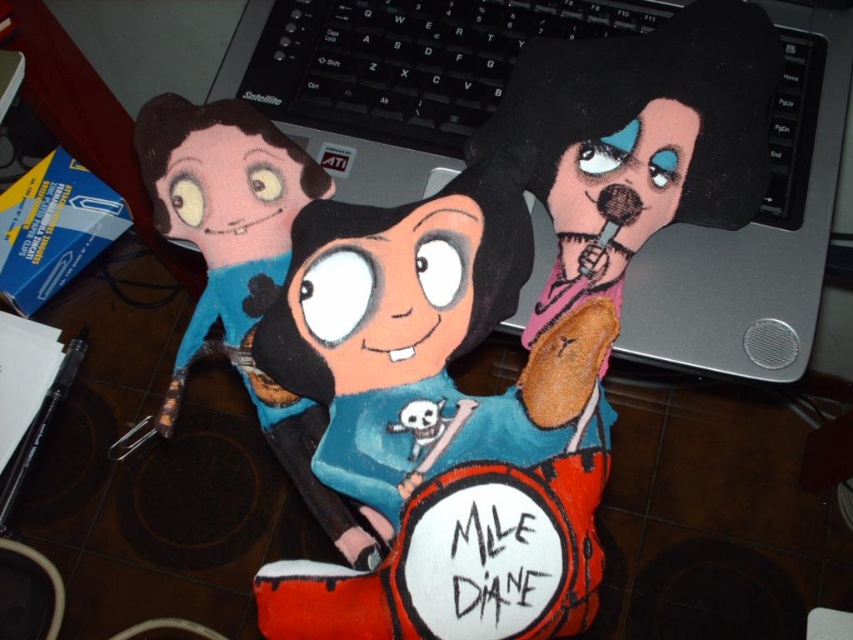
What do you see at coordinates (593, 141) in the screenshot? I see `silver metallic laptop at center` at bounding box center [593, 141].

Image resolution: width=853 pixels, height=640 pixels. Describe the element at coordinates (593, 141) in the screenshot. I see `silver metallic laptop at center` at that location.

Find the location of a particular element. The width and height of the screenshot is (853, 640). silver metallic laptop at center is located at coordinates (593, 141).